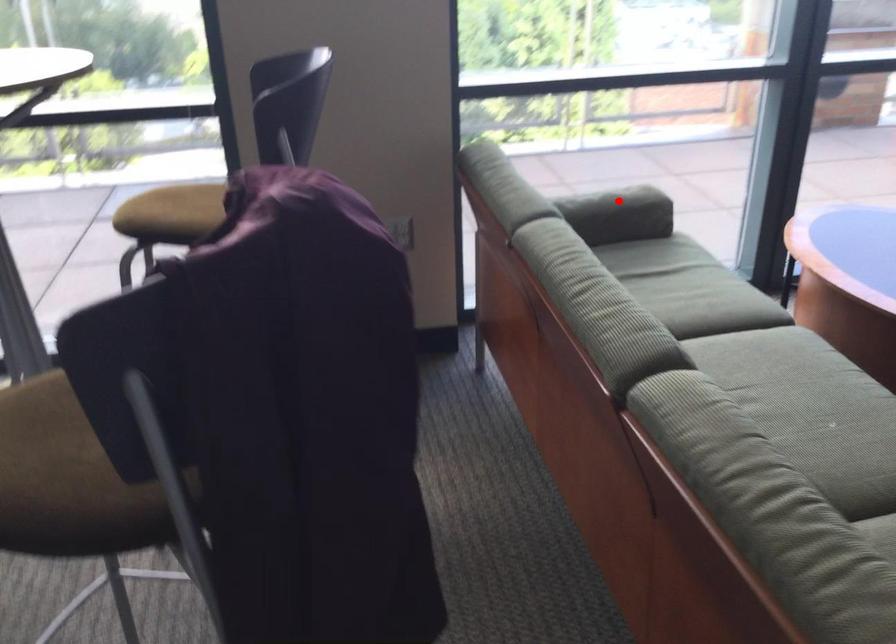
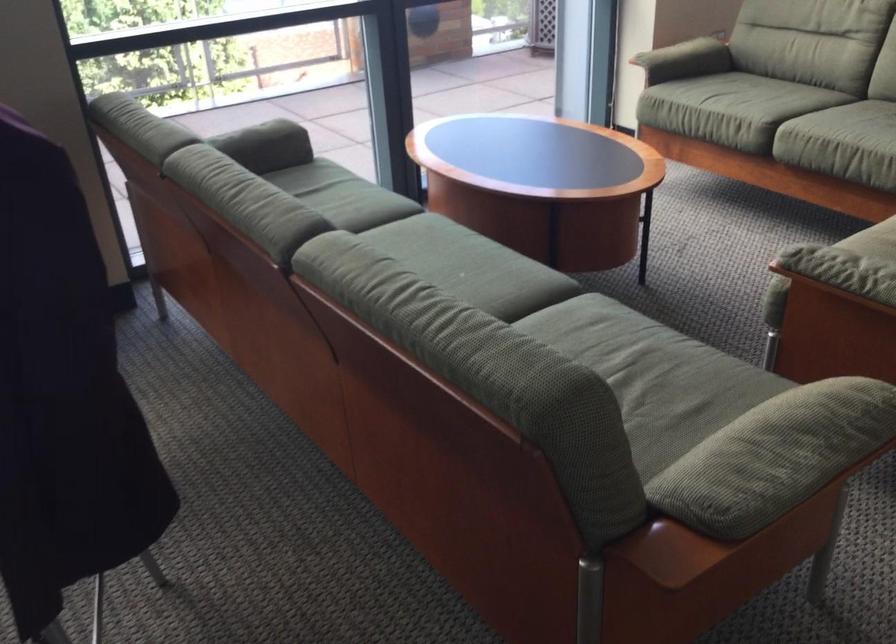
The point at the highlighted location is marked in the first image. Where is the corresponding point in the second image?

(265, 140)